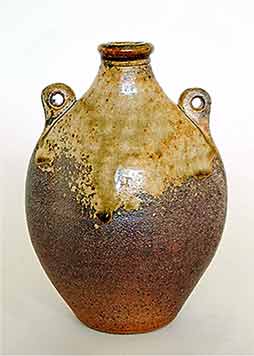
The width and height of the screenshot is (254, 356). I want to click on left handle, so click(54, 108).